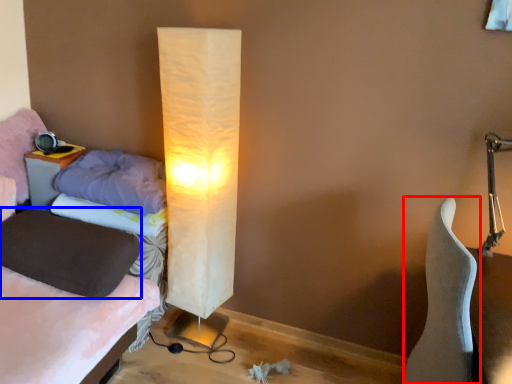
Question: Which of the following is the closest to the observer, furniture (highlighted by a red box) or pillow (highlighted by a blue box)?

Choices:
 (A) furniture
 (B) pillow

Answer: (A)